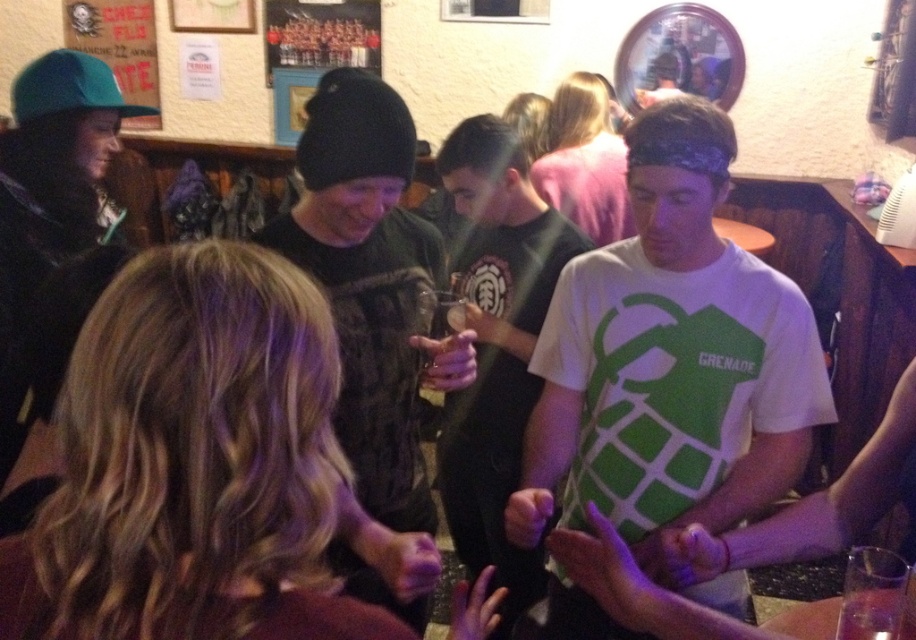
Does white matte t-shirt at center come behind transparent plastic cup at lower right?

Yes, it is.

The image size is (916, 640). What do you see at coordinates (671, 358) in the screenshot?
I see `white matte t-shirt at center` at bounding box center [671, 358].

This screenshot has width=916, height=640. What are the coordinates of `white matte t-shirt at center` in the screenshot? It's located at (671, 358).

Does black knit cap at center appear on the right side of dark green t-shirt at center?

In fact, black knit cap at center is to the left of dark green t-shirt at center.

Between point (318, 266) and point (474, 406), which one is positioned behind?

Point (474, 406)

Find the location of `black knit cap at center`. black knit cap at center is located at coordinates (372, 285).

Is the position of black knit cap at center more distant than that of transparent plastic cup at lower right?

Yes.

From the picture: Between black knit cap at center and transparent plastic cup at lower right, which one appears on the left side from the viewer's perspective?

black knit cap at center

Is point (380, 516) closer to camera compared to point (881, 616)?

That is False.

This screenshot has height=640, width=916. I want to click on black knit cap at center, so click(372, 285).